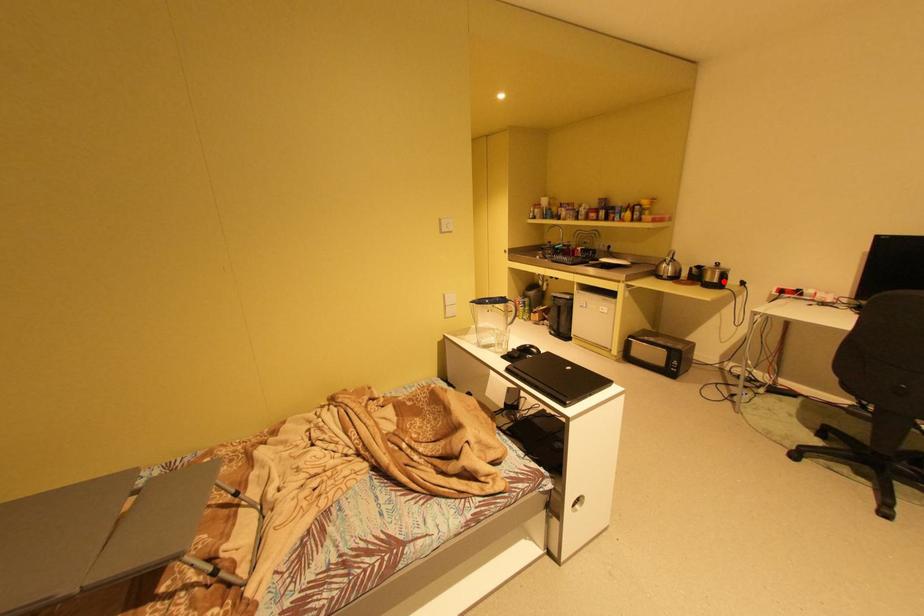
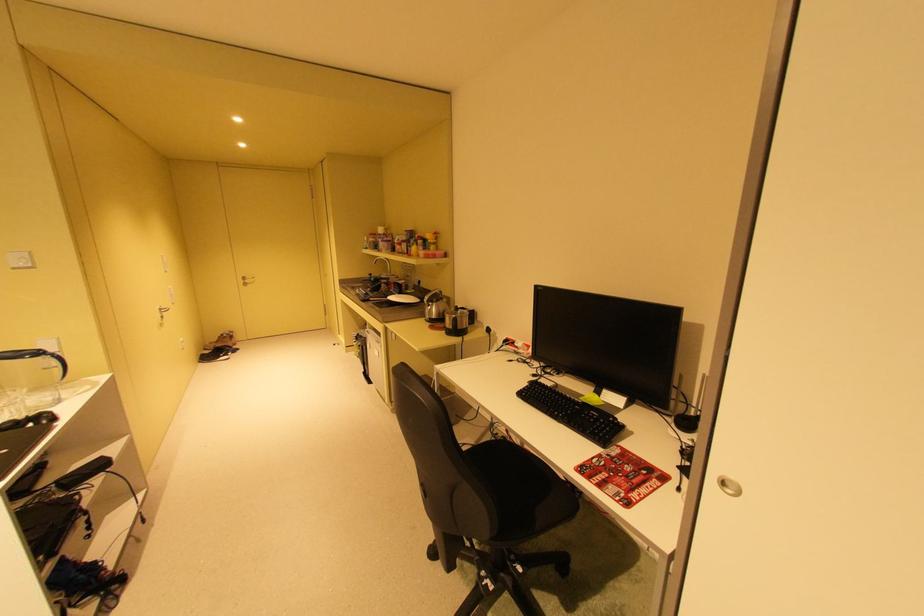
Question: I am providing you with two images of the same scene from different viewpoints. Given a red point in image1, look at the same physical point in image2. Is it:

Choices:
 (A) Closer to the viewpoint
 (B) Farther from the viewpoint

Answer: (B)